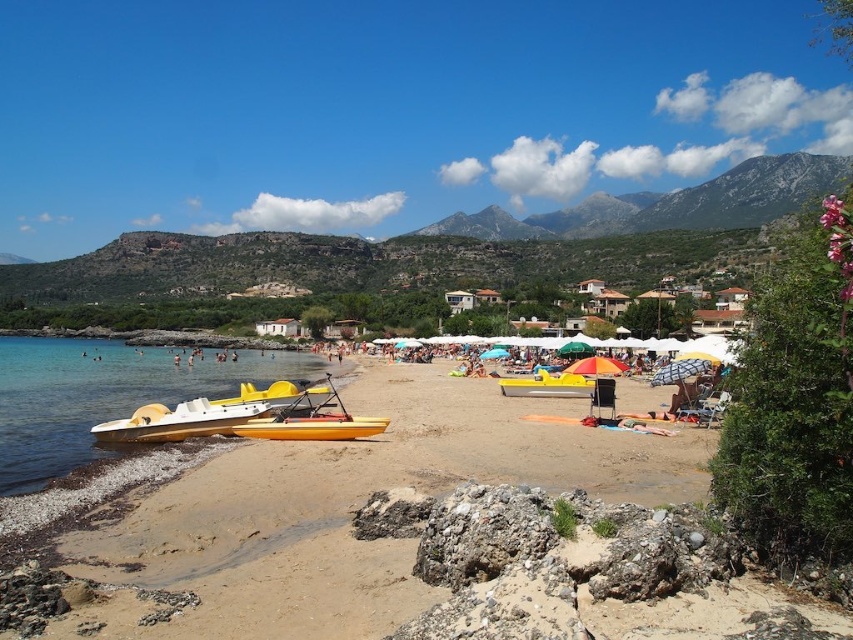
You are standing on the beach and want to place your yellow matte kayak at lower center onto the yellow sand at lower left. Is the kayak already positioned on the sand?

The yellow sand at lower left is below the yellow matte kayak at lower center, meaning the kayak is already placed on the sand.